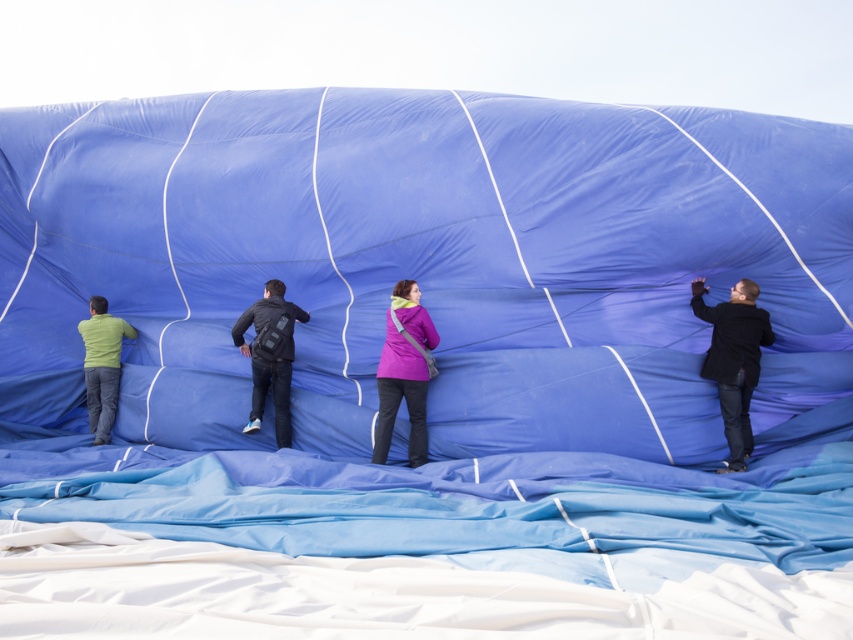
Can you confirm if purple matte jacket at center is wider than dark blue fabric at center?

No, purple matte jacket at center is not wider than dark blue fabric at center.

Which is below, purple matte jacket at center or dark blue fabric at center?

purple matte jacket at center is below.

Does point (409, 458) come farther from viewer compared to point (248, 429)?

No.

Identify the location of purple matte jacket at center. (399, 396).

Which of these two, dark blue fabric at right or matte green shirt at left, stands taller?

dark blue fabric at right is taller.

What do you see at coordinates (734, 358) in the screenshot?
I see `dark blue fabric at right` at bounding box center [734, 358].

Locate an element on the screen. This screenshot has height=640, width=853. dark blue fabric at right is located at coordinates (x=734, y=358).

Between dark blue fabric at right and purple matte jacket at center, which one has more height?

With more height is dark blue fabric at right.

Is dark blue fabric at right closer to camera compared to purple matte jacket at center?

That is True.

Where is `dark blue fabric at right`? The height and width of the screenshot is (640, 853). dark blue fabric at right is located at coordinates (734, 358).